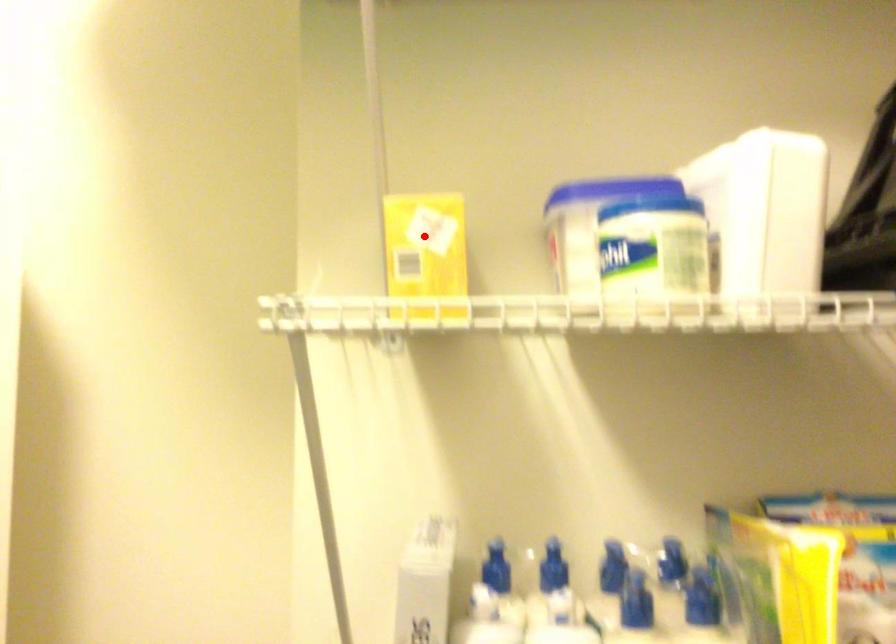
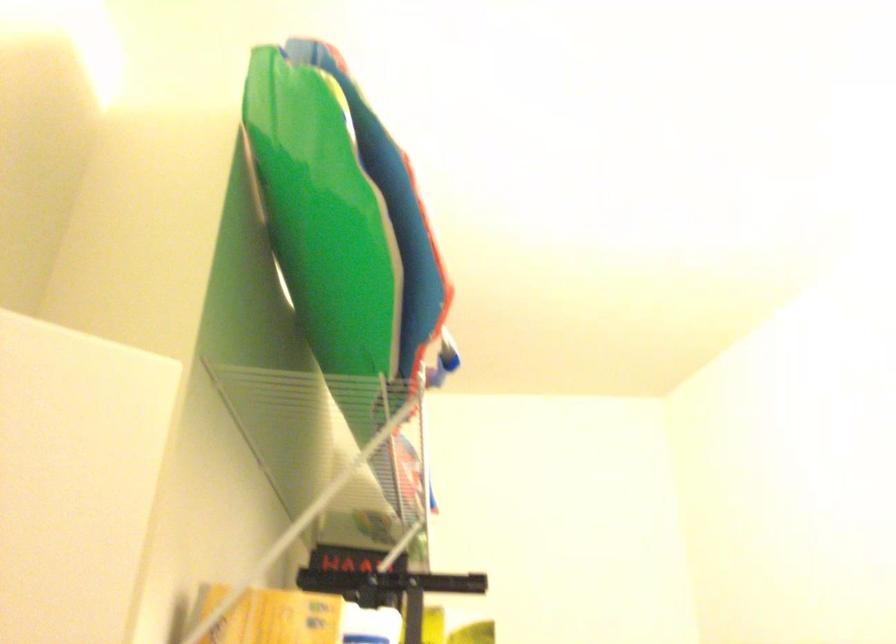
Question: I am providing you with two images of the same scene from different viewpoints. Given a red point in image1, look at the same physical point in image2. Is it:

Choices:
 (A) Closer to the viewpoint
 (B) Farther from the viewpoint

Answer: (B)